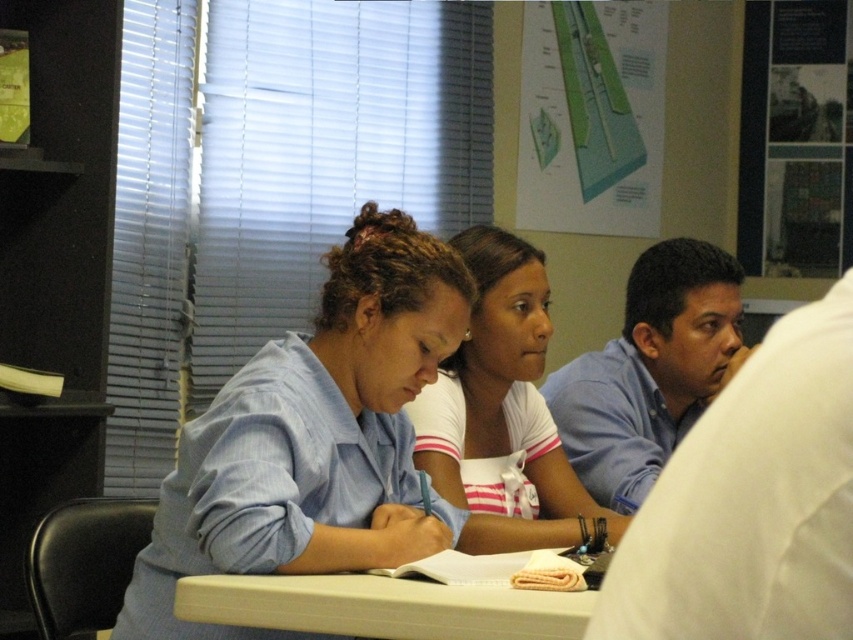
In the scene shown: You are a student sitting at the back of the classroom. You want to see the white striped shirt at center and the green paper at upper center. Which one is taller from your perspective?

The white striped shirt at center is not as tall as the green paper at upper center, so the green paper at upper center is taller.